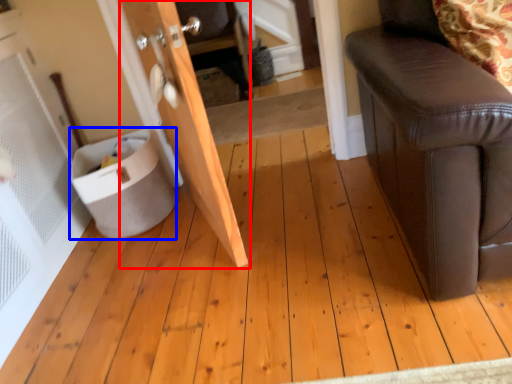
Question: Which of the following is the farthest to the observer, door (highlighted by a red box) or potty (highlighted by a blue box)?

Choices:
 (A) door
 (B) potty

Answer: (B)